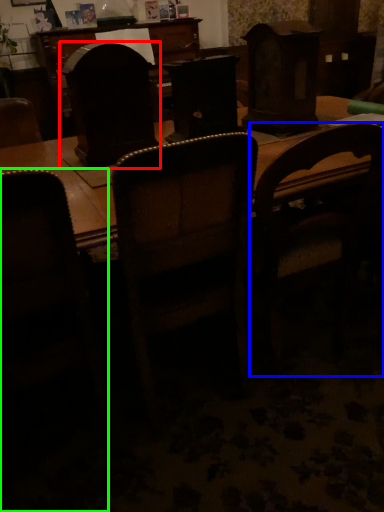
Question: Which object is positioned closest to swivel chair (highlighted by a red box)? Select from chair (highlighted by a blue box) and chair (highlighted by a green box).

Choices:
 (A) chair
 (B) chair

Answer: (B)